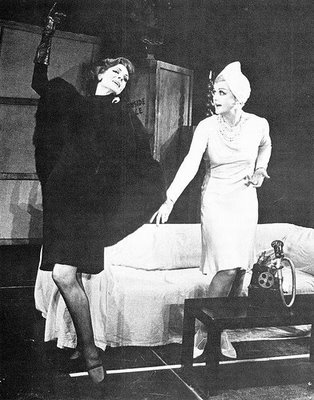
Identify the location of sheet. (301, 239), (146, 309), (143, 249), (58, 320).